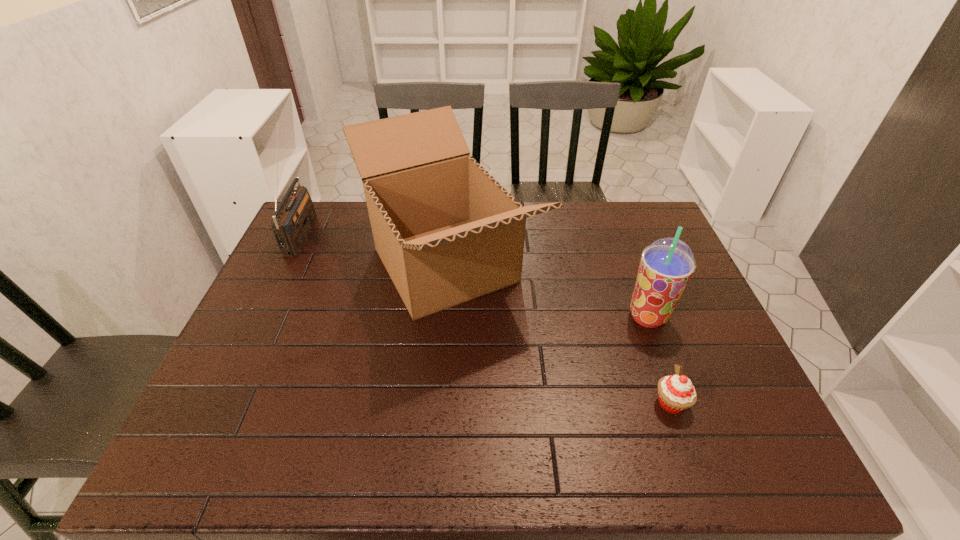
The height and width of the screenshot is (540, 960). What are the coordinates of `radio receiver located in the far edge section of the desktop` in the screenshot? It's located at click(x=295, y=216).

The width and height of the screenshot is (960, 540). I want to click on object present at the left edge, so click(295, 216).

Locate an element on the screen. The image size is (960, 540). smoothie that is at the right edge is located at coordinates (667, 264).

You are a GUI agent. You are given a task and a screenshot of the screen. Output one action in this format:
    pyautogui.click(x=<x>, y=<y>)
    Task: Click on the cupcake that is at the right edge
    Image resolution: width=960 pixels, height=540 pixels.
    Given the screenshot: What is the action you would take?
    pyautogui.click(x=676, y=393)

Locate an element on the screen. The width and height of the screenshot is (960, 540). object present at the far left corner is located at coordinates (295, 216).

I want to click on free space at the near edge of the desktop, so click(x=546, y=472).

Image resolution: width=960 pixels, height=540 pixels. What are the coordinates of `free space at the left edge of the desktop` in the screenshot? It's located at (287, 281).

Image resolution: width=960 pixels, height=540 pixels. Find the location of `vacant space at the right edge of the desktop`. vacant space at the right edge of the desktop is located at coordinates (696, 341).

In the image, there is a desktop. At what (x,y) coordinates should I click in order to perform the action: click on free space at the near left corner. Please return your answer as a coordinate pair (x, y). The image size is (960, 540). Looking at the image, I should click on tap(204, 433).

In the image, there is a desktop. Where is `vacant space at the far right corner`? vacant space at the far right corner is located at coordinates [x=610, y=208].